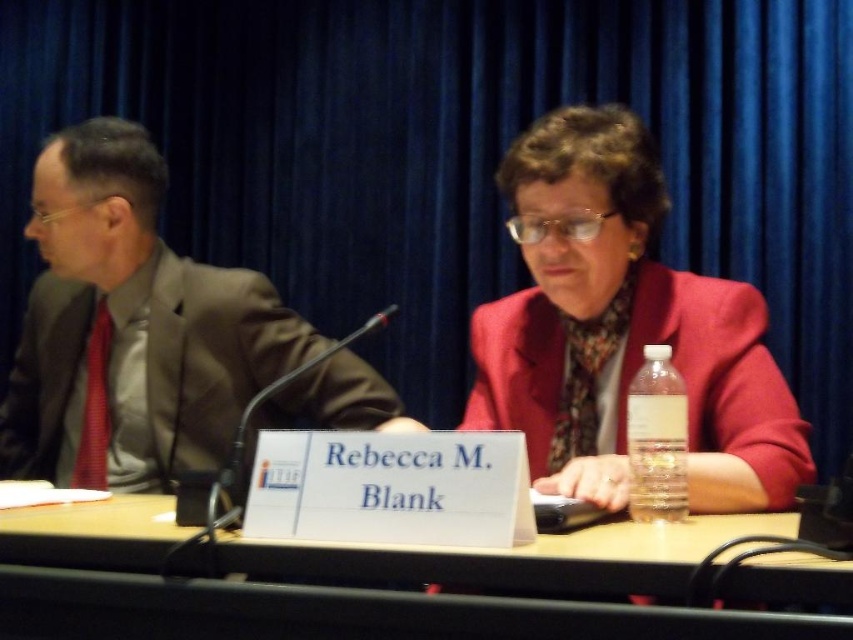
You are a photographer adjusting your camera settings to focus on two points on the table in the scene. The points are labeled as point (x=782, y=488) and point (x=402, y=422). Which point should you focus on first if you want to ensure the closest one to the viewer is sharp?

Point (x=782, y=488) is closer to the viewer than point (x=402, y=422), so you should focus on point (x=782, y=488) first to ensure the closest one is sharp.

You are a photographer adjusting your camera settings to capture the scene. You notice the matte red blazer at center and the wooden table at center. Which object is positioned more to the right side of the frame?

The matte red blazer at center is to the right of the wooden table at center, so it is positioned more to the right side of the frame.

You are a photographer trying to capture a closeup of the nameplate of Rebecca M. Blank in the image. The camera you are using has a very narrow field of view. You can only see a small portion of the scene at a time. You can move the camera left or right. Currently, the camera is pointed at the point indicated by point [131,328]. Do you need to move the camera to the left or right to get the nameplate into the frame?

The point [131,328] indicates the matte brown suit at left. The nameplate of Rebecca M. Blank is in front of her, which is on the right side of the image. Therefore, you need to move the camera to the right to get the nameplate into the frame.